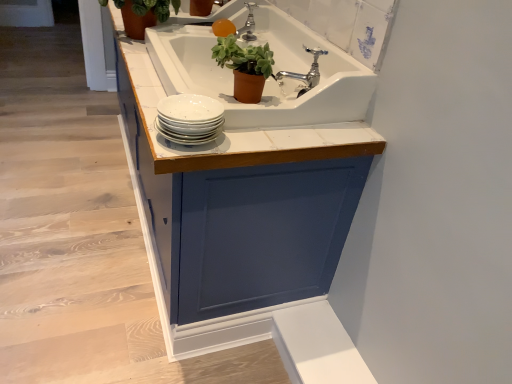
Question: Can you confirm if silver metallic tap at upper center, which ranks as the 2th tap in bottom-to-top order, is smaller than white glossy plates at center?

Choices:
 (A) no
 (B) yes

Answer: (B)

Question: Does silver metallic tap at upper center, marked as the first tap in a left-to-right arrangement, have a lesser width compared to white glossy plates at center?

Choices:
 (A) yes
 (B) no

Answer: (A)

Question: Can you confirm if silver metallic tap at upper center, which ranks as the 2th tap in bottom-to-top order, is taller than white glossy plates at center?

Choices:
 (A) yes
 (B) no

Answer: (A)

Question: Considering the relative positions of silver metallic tap at upper center, acting as the 2th tap starting from the right, and white glossy plates at center in the image provided, is silver metallic tap at upper center, acting as the 2th tap starting from the right, in front of white glossy plates at center?

Choices:
 (A) yes
 (B) no

Answer: (B)

Question: Is silver metallic tap at upper center, the first tap positioned from the back, facing away from white glossy plates at center?

Choices:
 (A) no
 (B) yes

Answer: (A)

Question: Can you confirm if silver metallic tap at upper center, which ranks as the 2th tap in bottom-to-top order, is shorter than white glossy plates at center?

Choices:
 (A) yes
 (B) no

Answer: (B)

Question: Is blue painted cabinet at center next to green matte plant at upper left, which is counted as the first houseplant, starting from the back, and touching it?

Choices:
 (A) yes
 (B) no

Answer: (B)

Question: Is there a large distance between blue painted cabinet at center and green matte plant at upper left, marked as the second houseplant in a right-to-left arrangement?

Choices:
 (A) no
 (B) yes

Answer: (A)

Question: Is blue painted cabinet at center facing towards green matte plant at upper left, which appears as the 1th houseplant when viewed from the left?

Choices:
 (A) yes
 (B) no

Answer: (B)

Question: Can you confirm if blue painted cabinet at center is taller than green matte plant at upper left, which is counted as the 2th houseplant, starting from the bottom?

Choices:
 (A) no
 (B) yes

Answer: (B)

Question: From a real-world perspective, is blue painted cabinet at center positioned over green matte plant at upper left, which is the second houseplant in front-to-back order, based on gravity?

Choices:
 (A) no
 (B) yes

Answer: (A)

Question: Is blue painted cabinet at center in front of green matte plant at upper left, which appears as the 1th houseplant when viewed from the left?

Choices:
 (A) yes
 (B) no

Answer: (A)

Question: Considering the relative positions of white glossy cabinet at upper center and white glossy plates at center in the image provided, is white glossy cabinet at upper center to the right of white glossy plates at center from the viewer's perspective?

Choices:
 (A) no
 (B) yes

Answer: (A)